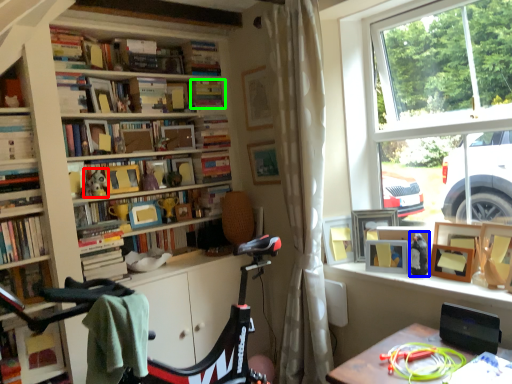
Question: Which is nearer to the toy (highlighted by a red box)? toy (highlighted by a blue box) or book (highlighted by a green box).

Choices:
 (A) toy
 (B) book

Answer: (B)